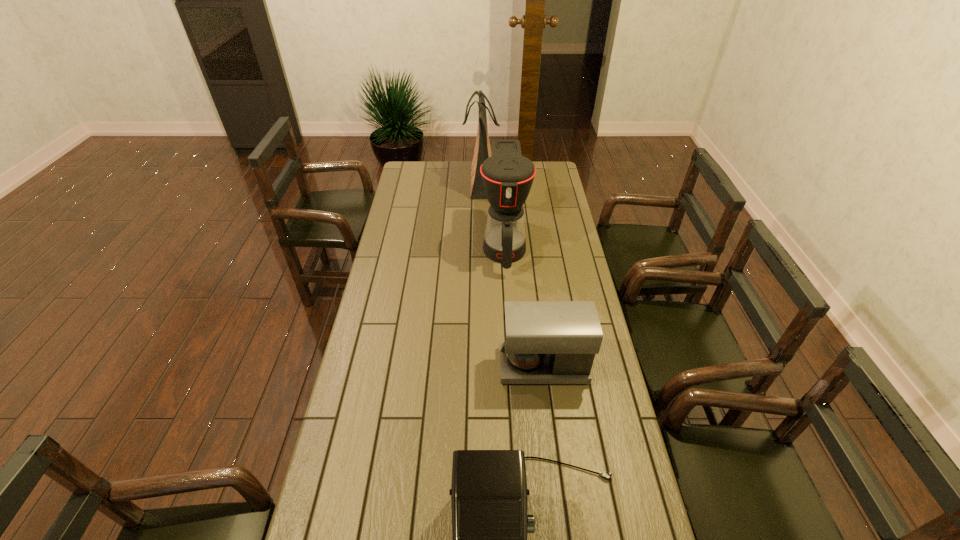
This screenshot has width=960, height=540. I want to click on coffee maker that is the third closest to the farthest object, so click(x=489, y=497).

I want to click on coffee maker that is the second closest one to the second farthest object, so click(489, 497).